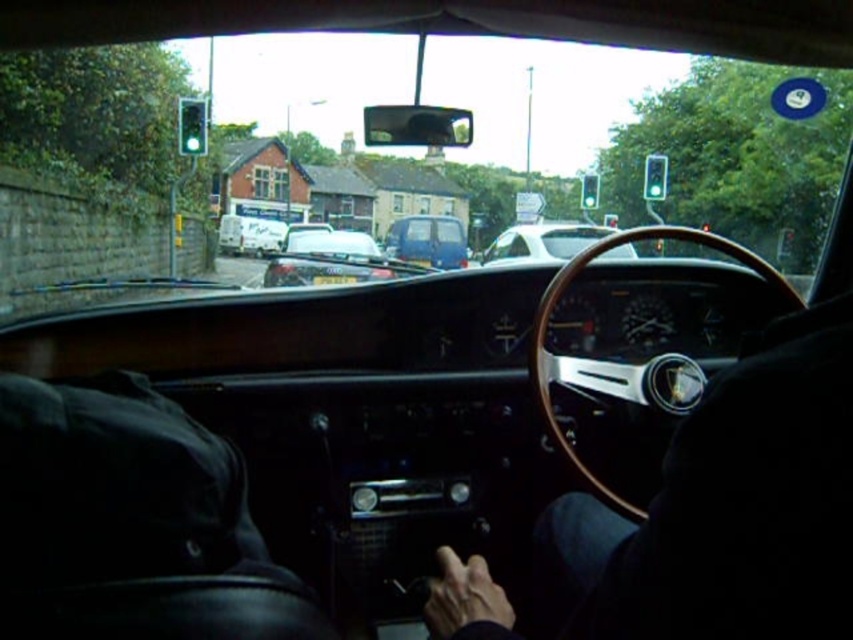
Based on the photo, you are driving a vintage car and looking at the dashboard. You see the wooden steering wheel at center and the green glass traffic light at upper left. Which object is positioned to the right of the other?

The green glass traffic light at upper left is positioned to the right of the wooden steering wheel at center.